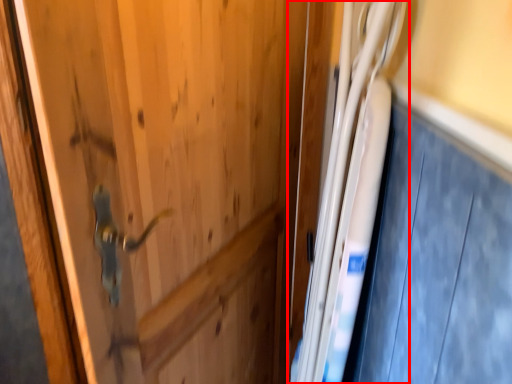
Question: Considering the relative positions of fridge (annotated by the red box) and car door in the image provided, where is fridge (annotated by the red box) located with respect to the staircase?

Choices:
 (A) left
 (B) right

Answer: (A)